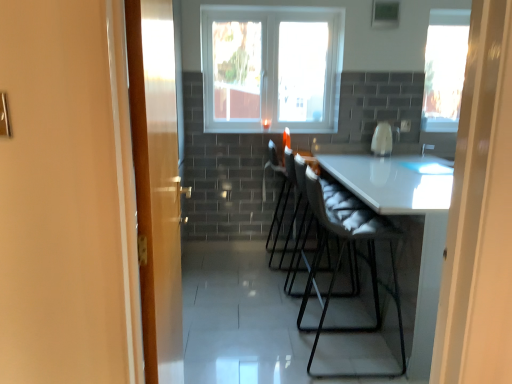
Locate an element on the screen. This screenshot has height=384, width=512. free spot to the left of white fabric chair at center, acting as the 1th chair starting from the front is located at coordinates (263, 347).